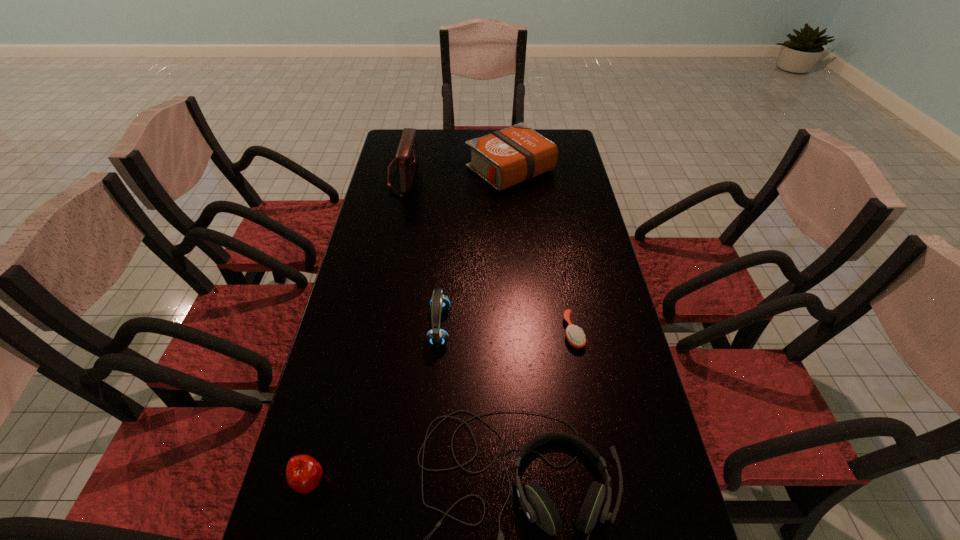
Locate an element on the screen. This screenshot has width=960, height=540. shoulder bag is located at coordinates (406, 159).

Where is `Bible`? This screenshot has height=540, width=960. Bible is located at coordinates (504, 158).

The width and height of the screenshot is (960, 540). I want to click on the farther headset, so click(439, 302).

This screenshot has height=540, width=960. Identify the location of the second shortest object. (303, 473).

In order to click on the shortest object in this screenshot , I will do `click(575, 336)`.

You are a GUI agent. You are given a task and a screenshot of the screen. Output one action in this format:
    pyautogui.click(x=<x>, y=<y>)
    Task: Click on the vacant space situated on the front flap of the shoulder bag
    This screenshot has height=540, width=960.
    Given the screenshot: What is the action you would take?
    pyautogui.click(x=477, y=177)

Where is `vacant space located on the back of the Bible`? vacant space located on the back of the Bible is located at coordinates (508, 135).

The width and height of the screenshot is (960, 540). Find the location of `free space located 0.110m on the ear cups of the farther headset`. free space located 0.110m on the ear cups of the farther headset is located at coordinates (492, 326).

Image resolution: width=960 pixels, height=540 pixels. In order to click on vacant space positioned on the right of the apple in this screenshot , I will do `click(501, 481)`.

Locate an element on the screen. The height and width of the screenshot is (540, 960). vacant space situated 0.140m on the left of the shortest object is located at coordinates (510, 332).